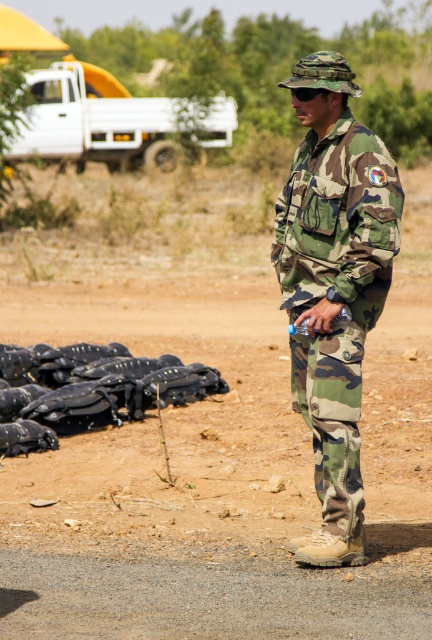
Question: Is camo fabric uniform at center wider than black matte helmets at lower left?

Choices:
 (A) no
 (B) yes

Answer: (A)

Question: Does camo fabric uniform at center lie in front of black matte helmets at lower left?

Choices:
 (A) yes
 (B) no

Answer: (A)

Question: Among these points, which one is nearest to the camera?

Choices:
 (A) coord(336,294)
 (B) coord(171,401)

Answer: (A)

Question: Which point is closer to the camera?

Choices:
 (A) camo fabric uniform at center
 (B) black matte helmets at lower left

Answer: (A)

Question: Which object appears farthest from the camera in this image?

Choices:
 (A) black matte helmets at lower left
 (B) camo fabric uniform at center

Answer: (A)

Question: Is camo fabric uniform at center further to the viewer compared to black matte helmets at lower left?

Choices:
 (A) yes
 (B) no

Answer: (B)